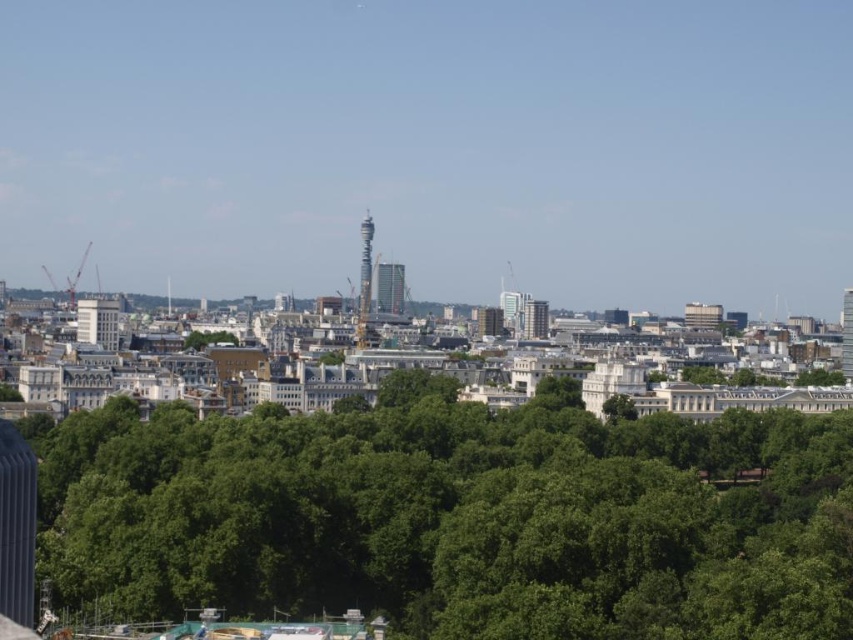
You are an architect reviewing the city layout. You see the glassy metallic tower at center and the metallic silver skyscraper at center. Which one has a greater height?

The glassy metallic tower at center is much taller than the metallic silver skyscraper at center according to the description provided.

You are standing in the city park looking at the skyline. You notice two silver structures at the center of your view. Which one is closer to you, the silver metallic tower at center or the metallic silver skyscraper at center?

The silver metallic tower at center is closer because it is positioned in front of the metallic silver skyscraper at center.

You are an urban planner analyzing the cityscape. You need to determine which of the two central structures, the glassy metallic tower at center or the metallic silver skyscraper at center, has a greater height. Based on the provided information, which one is taller?

The metallic silver skyscraper at center is taller than the glassy metallic tower at center.